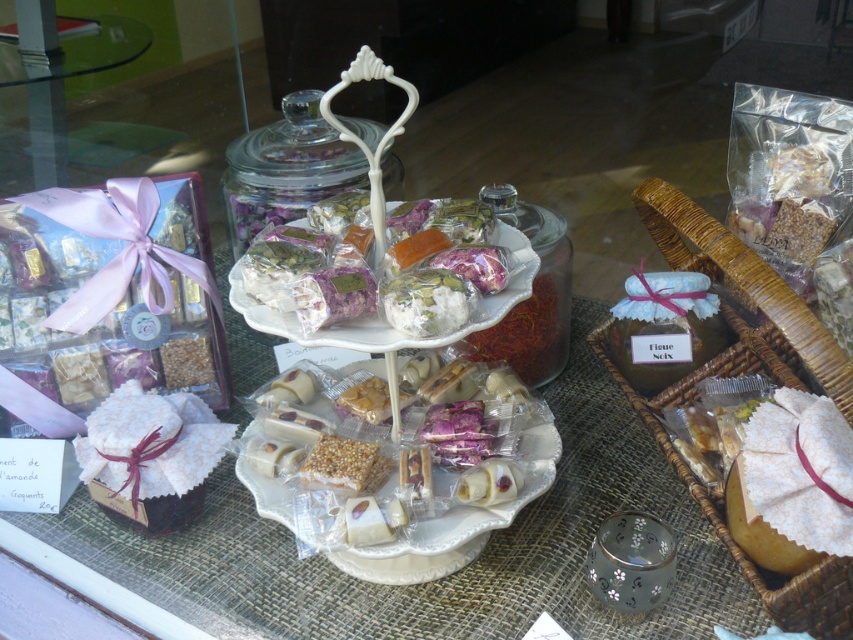
Question: Considering the real-world distances, which object is farthest from the translucent plastic wrapped candies at center?

Choices:
 (A) transparent glass jar at center
 (B) woven brown basket at right
 (C) matte white cloth at lower right
 (D) translucent glass saffron at center

Answer: (A)

Question: Does translucent plastic wrapped candies at center appear on the right side of transparent glass jar at center?

Choices:
 (A) no
 (B) yes

Answer: (B)

Question: Does translucent plastic wrapped candies at center have a smaller size compared to translucent glass saffron at center?

Choices:
 (A) no
 (B) yes

Answer: (A)

Question: Which of the following is the farthest from the observer?

Choices:
 (A) (717, 328)
 (B) (286, 188)

Answer: (B)

Question: Which point is closer to the camera?

Choices:
 (A) matte brown jar at center
 (B) matte white cloth at lower right
 (C) woven brown basket at right

Answer: (C)

Question: Is woven brown basket at right further to camera compared to translucent glass saffron at center?

Choices:
 (A) no
 (B) yes

Answer: (A)